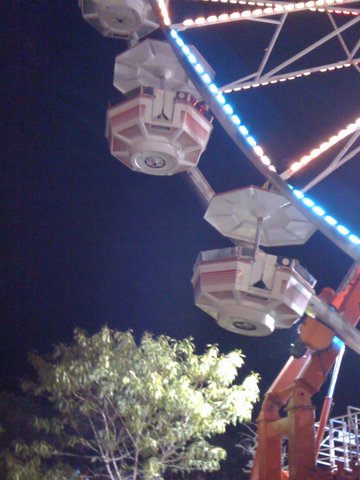
Where is `doors`? This screenshot has height=480, width=360. doors is located at coordinates (256, 267), (268, 269), (156, 102), (169, 108).